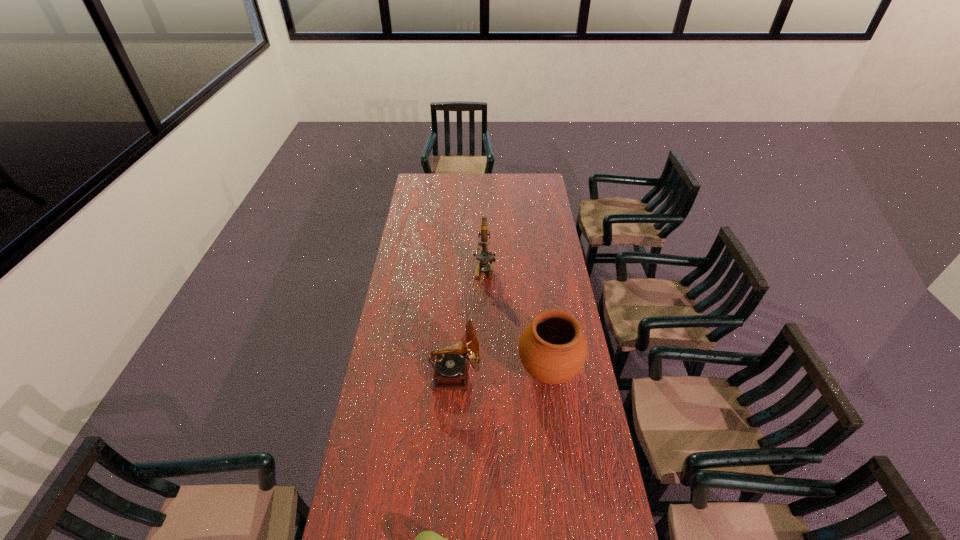
Identify the location of vacant region at the far right corner of the desktop. The height and width of the screenshot is (540, 960). (543, 178).

Where is `free spot between the phonograph_record and the rightmost object`? free spot between the phonograph_record and the rightmost object is located at coordinates (502, 373).

At what (x,y) coordinates should I click in order to perform the action: click on free space between the microscope and the pottery. Please return your answer as a coordinate pair (x, y). The width and height of the screenshot is (960, 540). Looking at the image, I should click on (516, 320).

Image resolution: width=960 pixels, height=540 pixels. What are the coordinates of `vacant area that lies between the farthest object and the rightmost object` in the screenshot? It's located at (516, 320).

Where is `free area in between the rightmost object and the phonograph_record`? This screenshot has height=540, width=960. free area in between the rightmost object and the phonograph_record is located at coordinates (502, 373).

Select which object is the second closest to the shortest object. Please provide its 2D coordinates. Your answer should be formatted as a tuple, i.e. [(x, y)], where the tuple contains the x and y coordinates of a point satisfying the conditions above.

[(451, 368)]

I want to click on the closest object to the pottery, so click(x=451, y=368).

I want to click on free spot that satisfies the following two spatial constraints: 1. on the front side of the pottery; 2. on the horn of the phonograph_record, so click(549, 376).